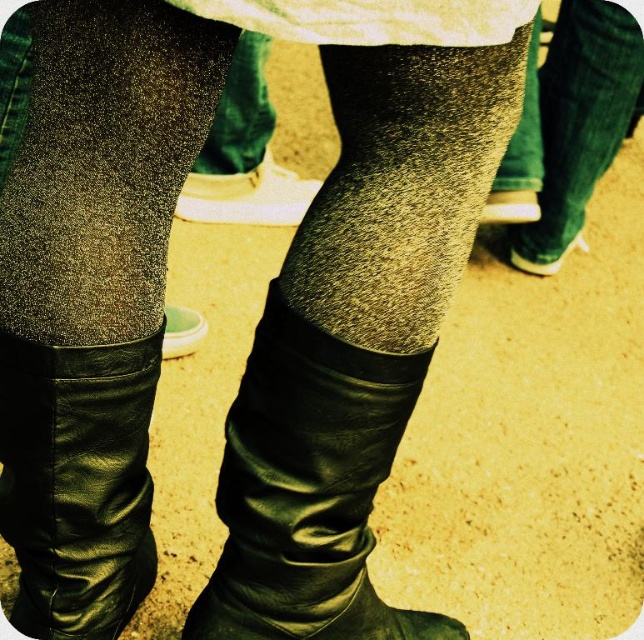
In the scene shown: You are standing in the image and want to move towards the sparkly metallic tights at center. Which direction should you move to reach them?

The sparkly metallic tights at center are located at point coordinates, so you should move towards the center of the image to reach them.

From the picture: You are a fashion designer trying to create a coordinated outfit. You have two items in front of you, the sparkly metallic tights at center and the matte black boot at center. Given their sizes, which item should you choose to emphasize the leg length?

The sparkly metallic tights at center has a larger size compared to the matte black boot at center, so choosing the sparkly metallic tights at center would better emphasize leg length due to their larger size.

You are a delivery robot that is 18 inches wide. You need to navigate between the matte white shoe at center and the matte black shoe at center. Can you fit through the space between them?

The matte white shoe at center is 21.18 inches from the matte black shoe at center, so yes, the robot can fit through the space between them since it is wider than the robot.